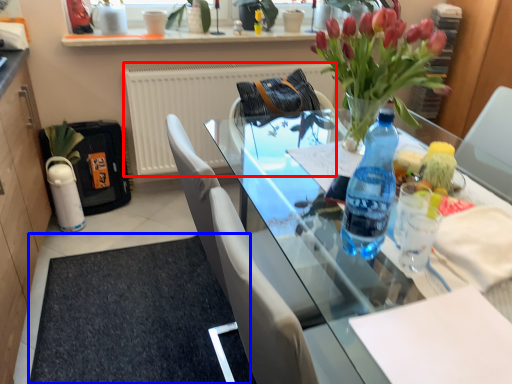
Question: Which object is closer to the camera taking this photo, radiator (highlighted by a red box) or doormat (highlighted by a blue box)?

Choices:
 (A) radiator
 (B) doormat

Answer: (B)